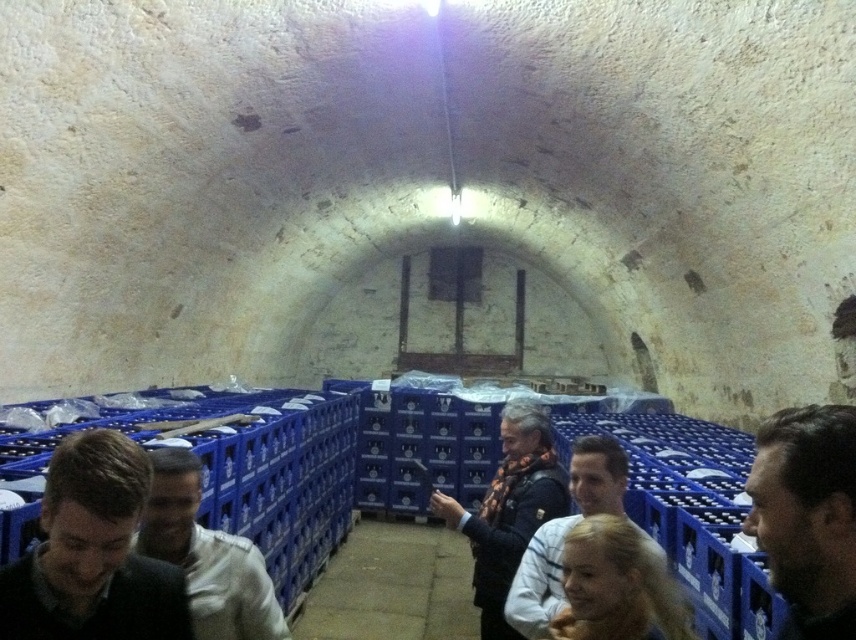
Between dark brown hair at lower left and dark brown hair at right, which one has more height?

Standing taller between the two is dark brown hair at lower left.

Does dark brown hair at lower left come behind dark brown hair at right?

Yes, dark brown hair at lower left is further from the viewer.

This screenshot has height=640, width=856. What are the coordinates of `dark brown hair at lower left` in the screenshot? It's located at (92, 554).

I want to click on dark brown hair at lower left, so click(92, 554).

How much distance is there between dark brown hair at right and white matte shirt at lower left?

dark brown hair at right is 1.46 meters away from white matte shirt at lower left.

Can you confirm if dark brown hair at right is positioned below white matte shirt at lower left?

No, dark brown hair at right is not below white matte shirt at lower left.

Who is more distant from viewer, [851,531] or [191,502]?

Positioned behind is point [191,502].

Where is `dark brown hair at right`? dark brown hair at right is located at coordinates (807, 516).

Is orange scarf at center thinner than dark blue jacket at lower center?

No, orange scarf at center is not thinner than dark blue jacket at lower center.

Is orange scarf at center wider than dark blue jacket at lower center?

Indeed, orange scarf at center has a greater width compared to dark blue jacket at lower center.

Identify the location of orange scarf at center. This screenshot has height=640, width=856. (509, 509).